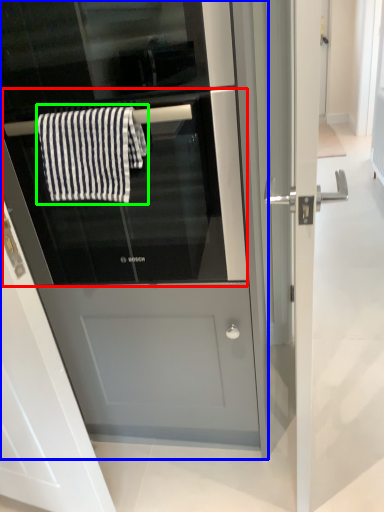
Question: Based on their relative distances, which object is farther from oven (highlighted by a red box)? Choose from fridge (highlighted by a blue box) and bath towel (highlighted by a green box).

Choices:
 (A) fridge
 (B) bath towel

Answer: (B)